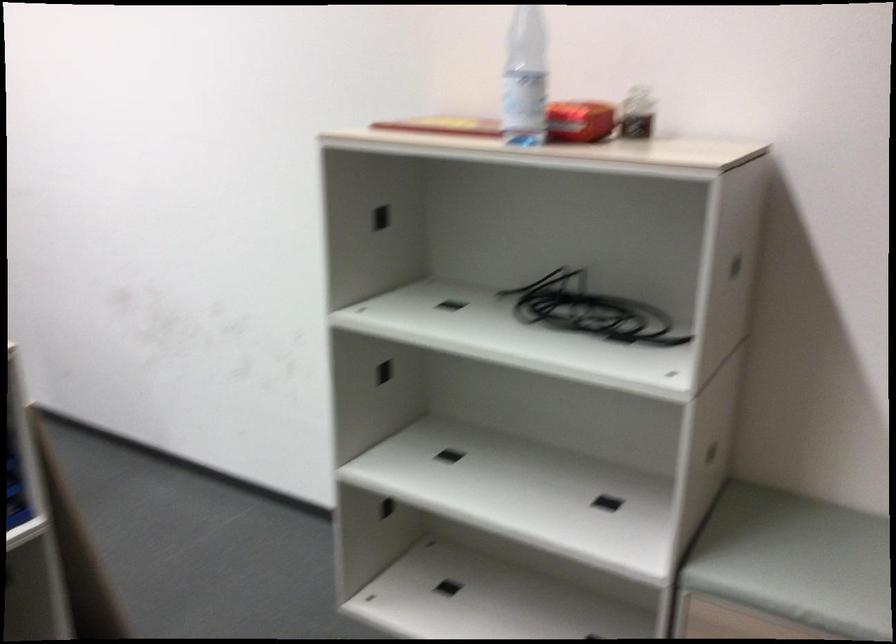
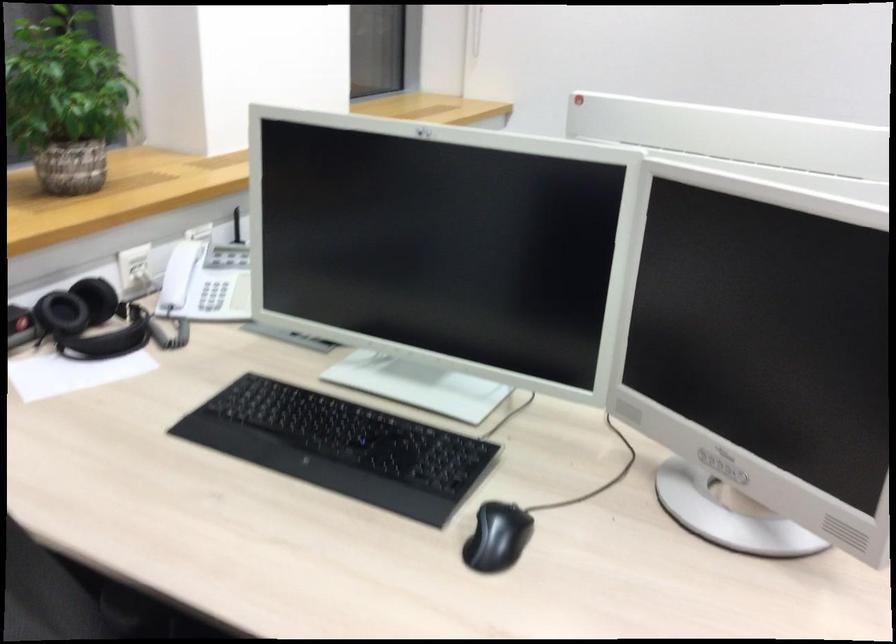
Question: Which direction would the cameraman need to move to produce the second image? Reply with the corresponding letter.

Choices:
 (A) Left
 (B) Right
 (C) Forward
 (D) Backward

Answer: (A)